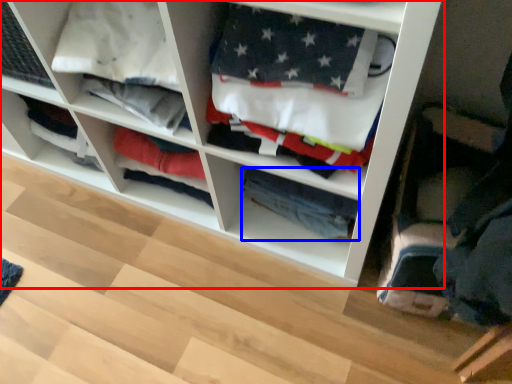
Question: Which object appears farthest to the camera in this image, shelf (highlighted by a red box) or clothing (highlighted by a blue box)?

Choices:
 (A) shelf
 (B) clothing

Answer: (B)